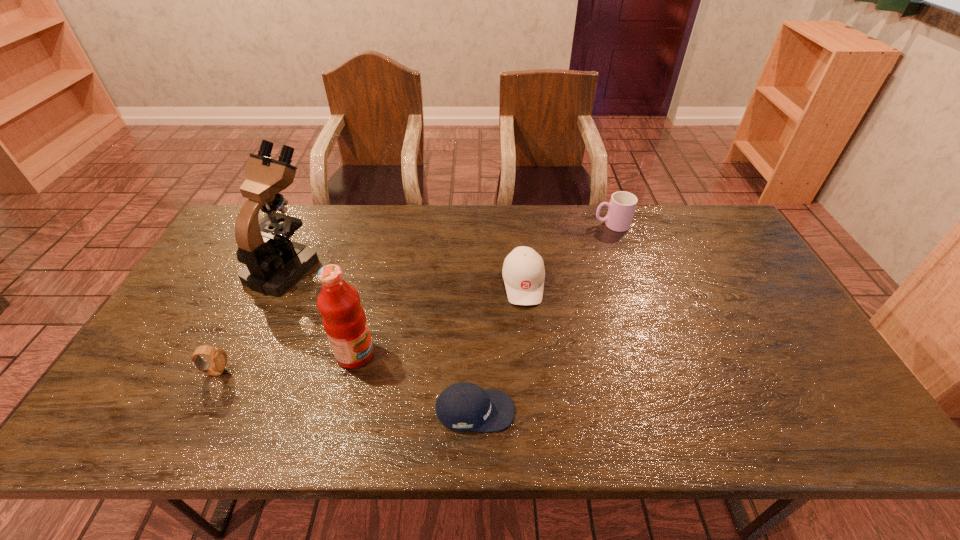
At what (x,y) coordinates should I click in order to perform the action: click on vacant region located 0.150m on the front label of the fourth object from right to left. Please return your answer as a coordinate pair (x, y). The height and width of the screenshot is (540, 960). Looking at the image, I should click on (433, 354).

Identify the location of vacant area situated 0.390m with the handle on the side of the rightmost object. (480, 225).

Locate an element on the screen. The image size is (960, 540). vacant region located 0.340m with the handle on the side of the rightmost object is located at coordinates (494, 225).

Locate an element on the screen. Image resolution: width=960 pixels, height=540 pixels. free spot located with the handle on the side of the rightmost object is located at coordinates (503, 225).

The height and width of the screenshot is (540, 960). I want to click on vacant space positioned 0.250m on the front-facing side of the farther baseball cap, so click(534, 385).

Where is `free space located 0.140m on the face of the watch`? The width and height of the screenshot is (960, 540). free space located 0.140m on the face of the watch is located at coordinates (285, 372).

The image size is (960, 540). What are the coordinates of `vacant space located 0.130m on the front-facing side of the shorter baseball cap` in the screenshot? It's located at (571, 411).

In order to click on microscope at the far edge in this screenshot , I will do `click(274, 263)`.

Locate an element on the screen. The width and height of the screenshot is (960, 540). cup located at the far edge is located at coordinates (621, 208).

Locate an element on the screen. object that is positioned at the near edge is located at coordinates (463, 406).